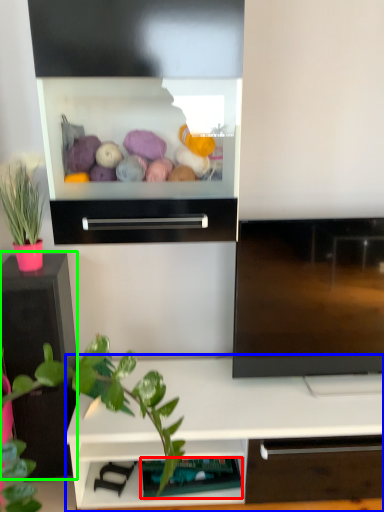
Question: Which is farther away from shelf (highlighted by a red box)? shelf (highlighted by a blue box) or tv cabinet (highlighted by a green box)?

Choices:
 (A) shelf
 (B) tv cabinet

Answer: (B)